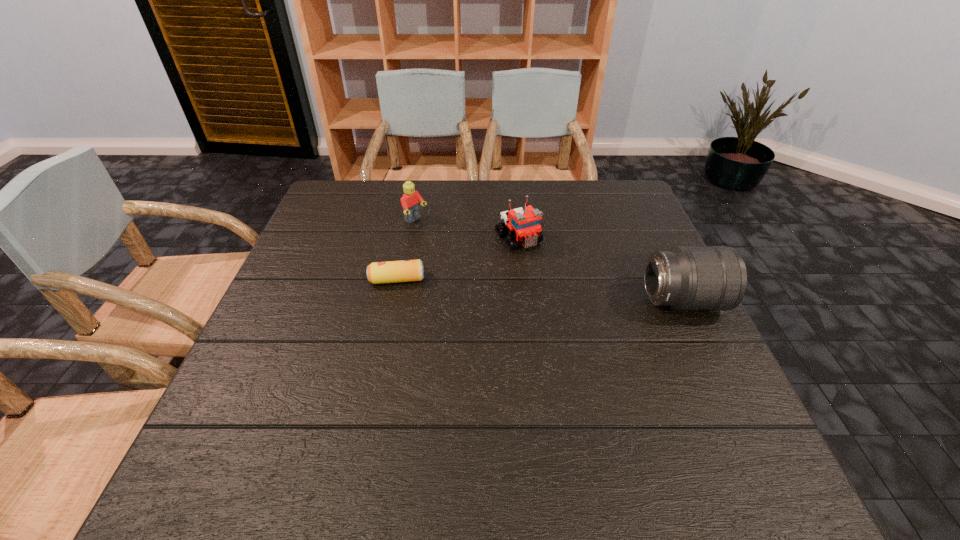
Locate an element on the screen. The width and height of the screenshot is (960, 540). vacant space at the near right corner of the desktop is located at coordinates (701, 403).

Where is `free space between the shortest object and the rightmost object`? free space between the shortest object and the rightmost object is located at coordinates (540, 291).

Locate an element on the screen. The height and width of the screenshot is (540, 960). free space between the left Lego and the third object from left to right is located at coordinates (467, 230).

In order to click on vacant space that is in between the beer can and the left Lego in this screenshot , I will do `click(406, 250)`.

Find the location of a particular element. The width and height of the screenshot is (960, 540). free point between the second object from right to left and the beer can is located at coordinates (458, 259).

This screenshot has height=540, width=960. In order to click on vacant area that lies between the beer can and the left Lego in this screenshot , I will do `click(406, 250)`.

The width and height of the screenshot is (960, 540). Identify the location of unoccupied position between the telephoto lens and the third object from left to right. (600, 270).

This screenshot has height=540, width=960. I want to click on empty space that is in between the second object from right to left and the left Lego, so click(x=467, y=230).

I want to click on unoccupied position between the telephoto lens and the left Lego, so click(549, 261).

Identify the location of vacant area that lies between the second object from right to left and the shortest object. (458, 259).